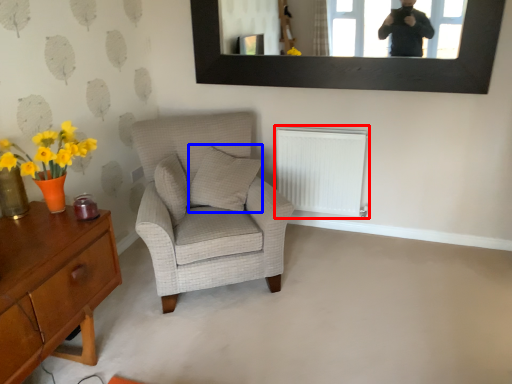
Question: Among these objects, which one is farthest to the camera, radiator (highlighted by a red box) or pillow (highlighted by a blue box)?

Choices:
 (A) radiator
 (B) pillow

Answer: (A)